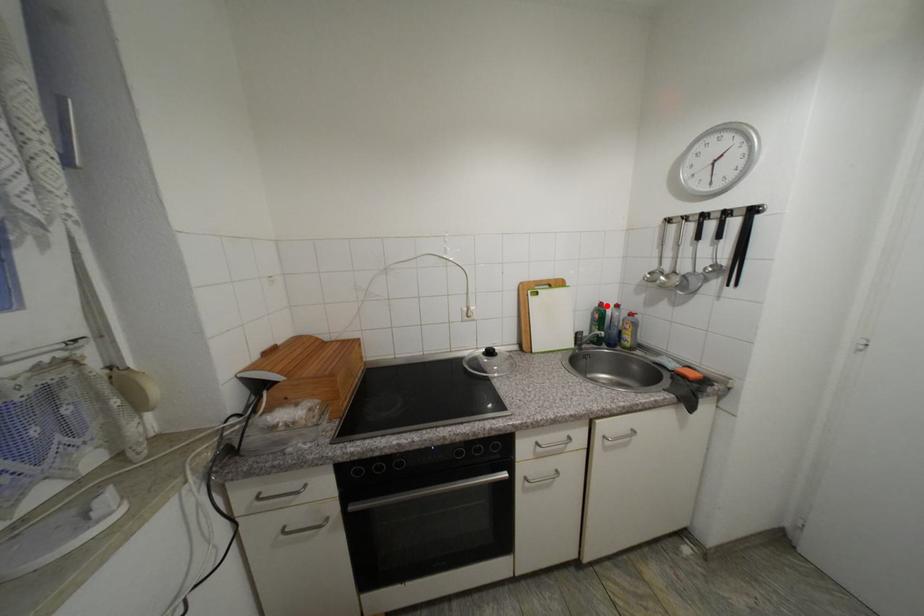
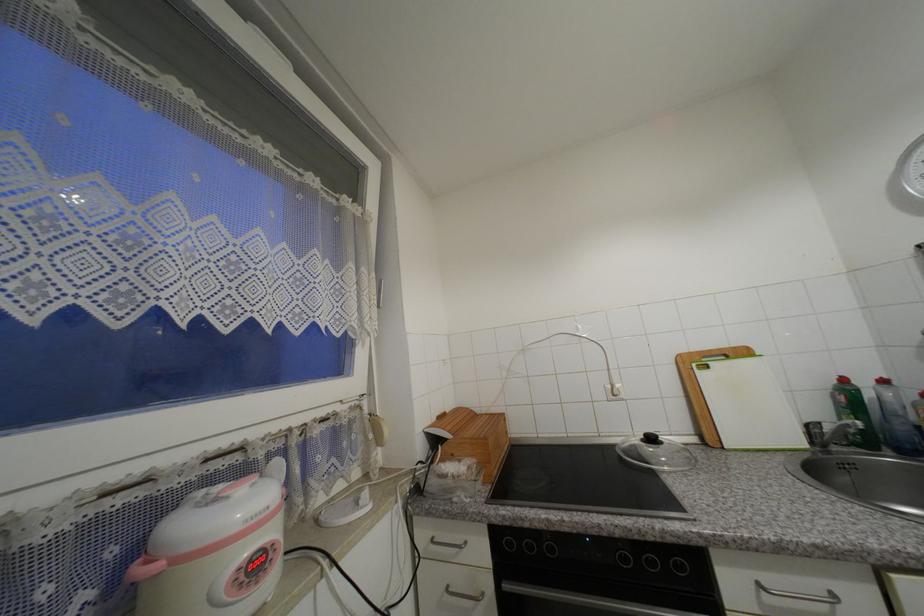
Where in the second image is the point corresponding to the highlighted location from the first image?

(849, 381)